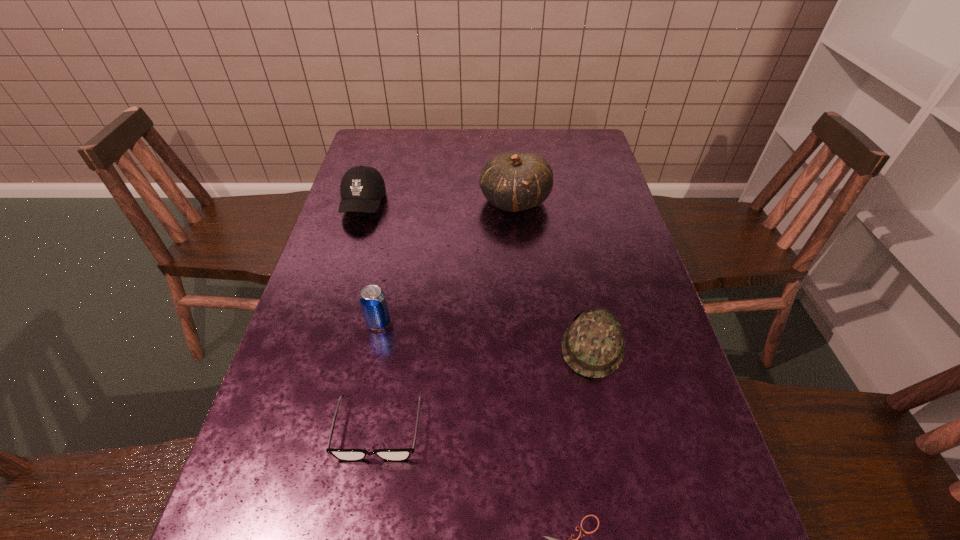
Identify the location of the tallest object. (513, 182).

You are a GUI agent. You are given a task and a screenshot of the screen. Output one action in this format:
    pyautogui.click(x=<x>, y=<y>)
    Task: Click on the beer can
    
    Given the screenshot: What is the action you would take?
    pyautogui.click(x=373, y=301)

At what (x,y) coordinates should I click in order to perform the action: click on baseball cap. Please return your answer as a coordinate pair (x, y). The height and width of the screenshot is (540, 960). Looking at the image, I should click on (362, 187).

Where is `headwear`? This screenshot has width=960, height=540. headwear is located at coordinates (593, 345).

Where is `the fifth farthest object`? The width and height of the screenshot is (960, 540). the fifth farthest object is located at coordinates (349, 455).

I want to click on the second shortest object, so click(349, 455).

The width and height of the screenshot is (960, 540). Find the location of `free space located 0.320m on the left of the tallest object`. free space located 0.320m on the left of the tallest object is located at coordinates (374, 201).

The image size is (960, 540). I want to click on vacant space located on the front of the beer can, so click(347, 483).

At what (x,y) coordinates should I click in order to perform the action: click on free space located on the front-facing side of the leftmost object. Please return your answer as a coordinate pair (x, y). Looking at the image, I should click on (342, 274).

You are a GUI agent. You are given a task and a screenshot of the screen. Output one action in this format:
    pyautogui.click(x=<x>, y=<y>)
    Task: Click on the free location located on the back of the third shortest object
    The width and height of the screenshot is (960, 540).
    Given the screenshot: What is the action you would take?
    pyautogui.click(x=582, y=293)